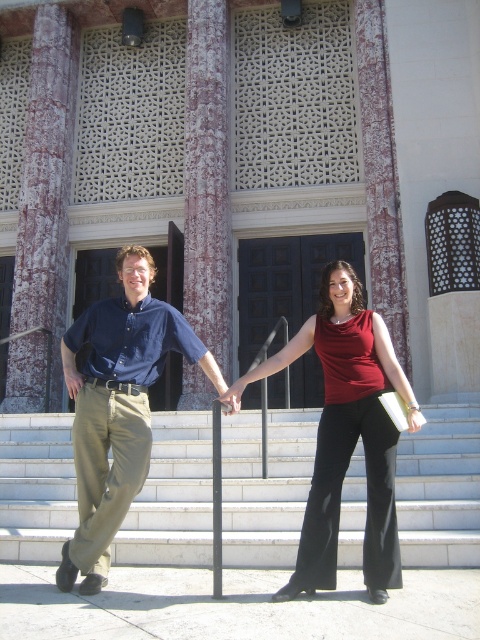
You are standing at the bottom of the steps looking up. You see a matte blue shirt at left and a metallic pole at center. Which object is closer to your right side?

The metallic pole at center is closer to your right side because the matte blue shirt at left is to the left of metallic pole at center.

You are standing at the bottom of the steps and want to hand a document to the person wearing the matte blue shirt at center. The metallic pole at center is in your way. Can you reach the person without moving the pole?

The matte blue shirt at center is positioned over the metallic pole at center, meaning the person is standing above the pole. Since the pole is below the person, you can reach them without moving the pole.